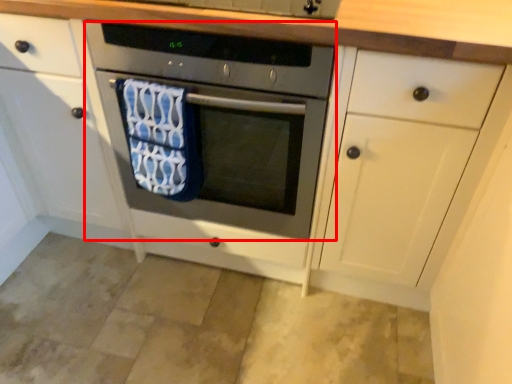
Question: Where is oven (annotated by the red box) located in relation to beach towel in the image?

Choices:
 (A) right
 (B) left

Answer: (A)